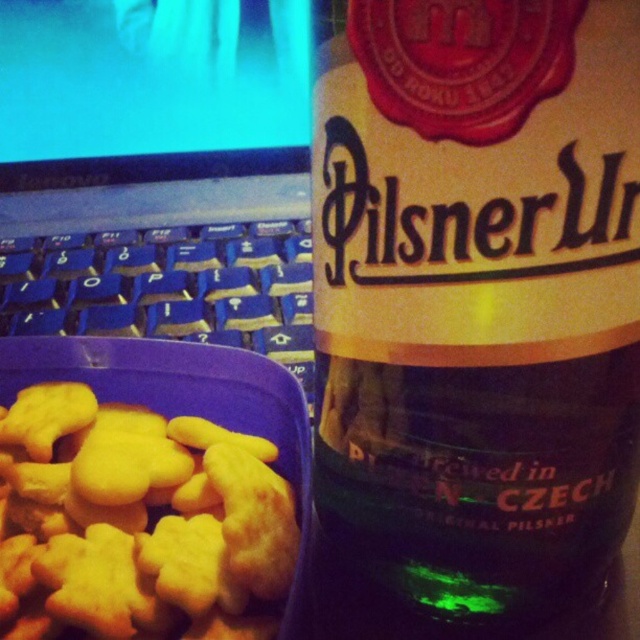
Question: Which of the following is the farthest from the observer?

Choices:
 (A) [x=19, y=310]
 (B) [x=488, y=157]
 (C) [x=97, y=97]

Answer: (C)

Question: Does dark amber glass bottle at upper right appear under blue plastic keyboard at lower left?

Choices:
 (A) no
 (B) yes

Answer: (B)

Question: Can you confirm if dark amber glass bottle at upper right is positioned above yellow matte cookie at center-left?

Choices:
 (A) yes
 (B) no

Answer: (A)

Question: Does dark amber glass bottle at upper right lie behind blue plastic keyboard at left?

Choices:
 (A) no
 (B) yes

Answer: (A)

Question: Which point is closer to the camera?

Choices:
 (A) (349, 296)
 (B) (282, 240)
 (C) (60, 596)
 (D) (132, 118)

Answer: (A)

Question: Which point appears closest to the camera in this image?

Choices:
 (A) (337, 346)
 (B) (272, 264)
 (C) (134, 332)

Answer: (A)